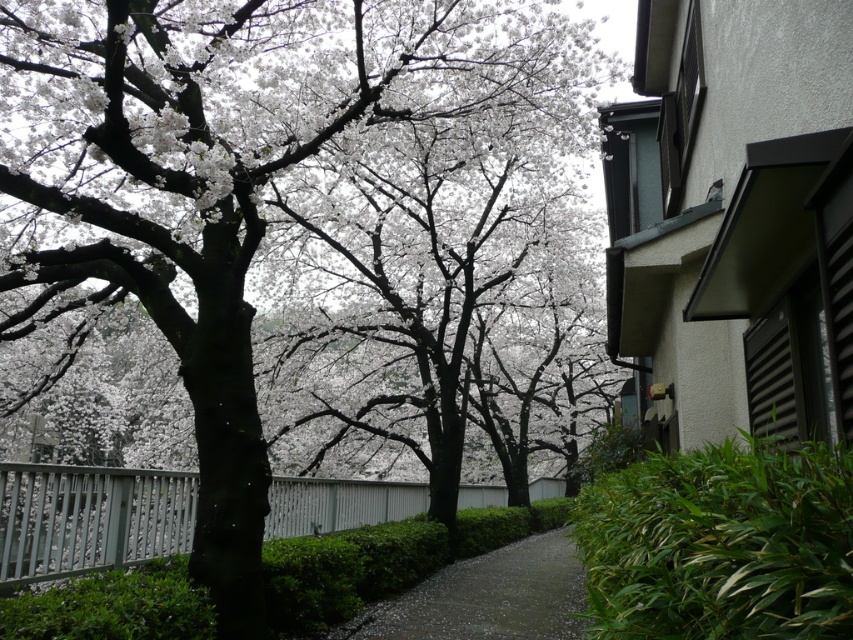
Question: Estimate the real-world distances between objects in this image. Which object is closer to the white blossoms at center?

Choices:
 (A) dark gray gravel path at center
 (B) white painted wood fence at lower left

Answer: (B)

Question: Can you confirm if white blossoms at center is thinner than white painted wood fence at lower left?

Choices:
 (A) yes
 (B) no

Answer: (B)

Question: Does white blossoms at center appear on the left side of white painted wood fence at lower left?

Choices:
 (A) yes
 (B) no

Answer: (A)

Question: Can you confirm if white blossoms at center is positioned above dark gray gravel path at center?

Choices:
 (A) no
 (B) yes

Answer: (B)

Question: Which point is farther to the camera?

Choices:
 (A) (262, 106)
 (B) (521, 614)

Answer: (B)

Question: Which point appears farthest from the camera in this image?

Choices:
 (A) (355, 22)
 (B) (181, 525)

Answer: (B)